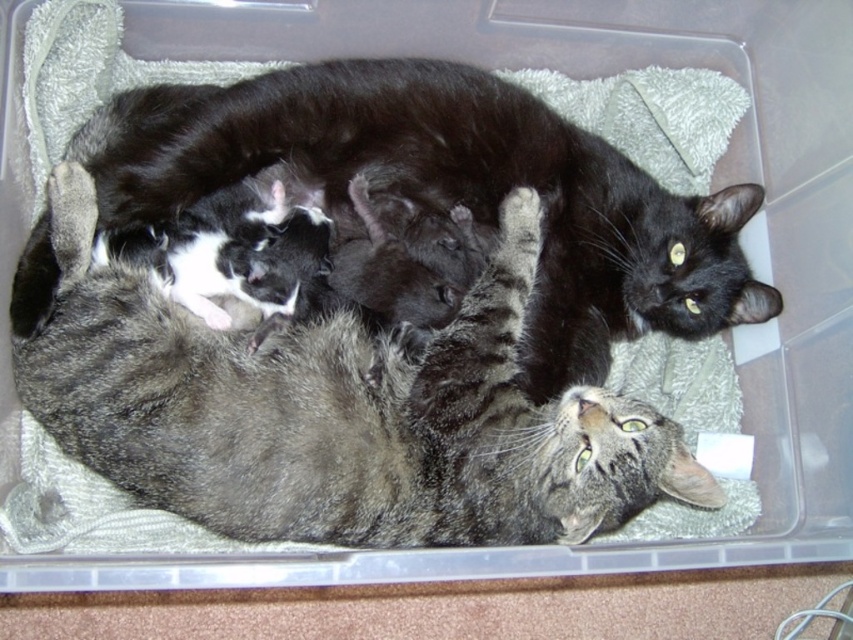
Can you confirm if tabby fur cat at center is positioned to the right of black fur cat at upper center?

No, tabby fur cat at center is not to the right of black fur cat at upper center.

In the scene shown: Between tabby fur cat at center and black fur cat at upper center, which one has more height?

black fur cat at upper center is taller.

Where is `tabby fur cat at center`? tabby fur cat at center is located at coordinates (339, 412).

Identify the location of tabby fur cat at center. (339, 412).